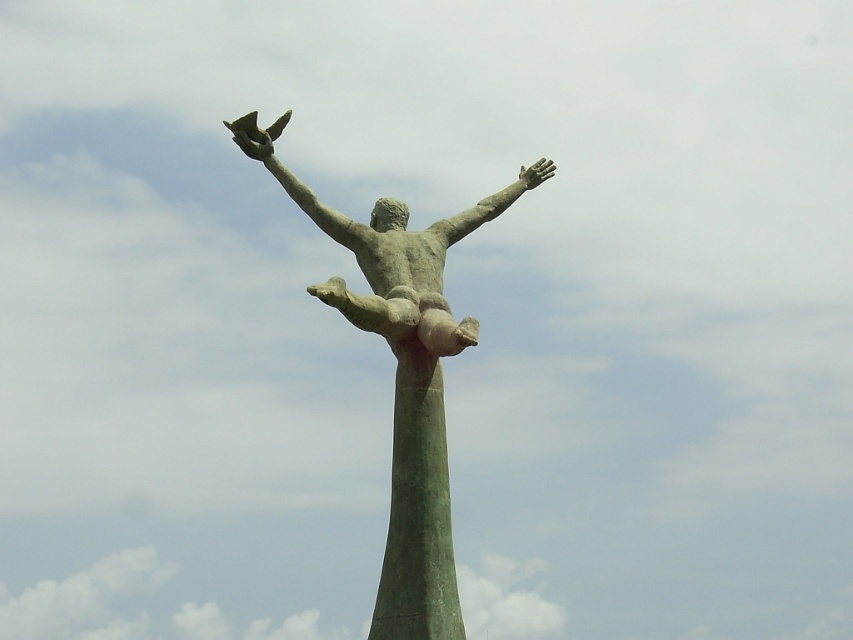
Question: Among these points, which one is farthest from the camera?

Choices:
 (A) (456, 214)
 (B) (460, 216)
 (C) (392, 260)
 (D) (384, 554)

Answer: (A)

Question: Does green patina statue at center have a greater width compared to green patina pole at center?

Choices:
 (A) no
 (B) yes

Answer: (B)

Question: Is bronze statue at center closer to the viewer compared to green patina pole at center?

Choices:
 (A) no
 (B) yes

Answer: (B)

Question: Which of the following is the farthest from the observer?

Choices:
 (A) (486, 214)
 (B) (445, 349)
 (C) (440, 516)

Answer: (A)

Question: Is green patina statue at center to the right of bronze statue at center from the viewer's perspective?

Choices:
 (A) no
 (B) yes

Answer: (A)

Question: Which point is farther to the camera?

Choices:
 (A) (440, 269)
 (B) (469, 230)
 (C) (409, 477)

Answer: (B)